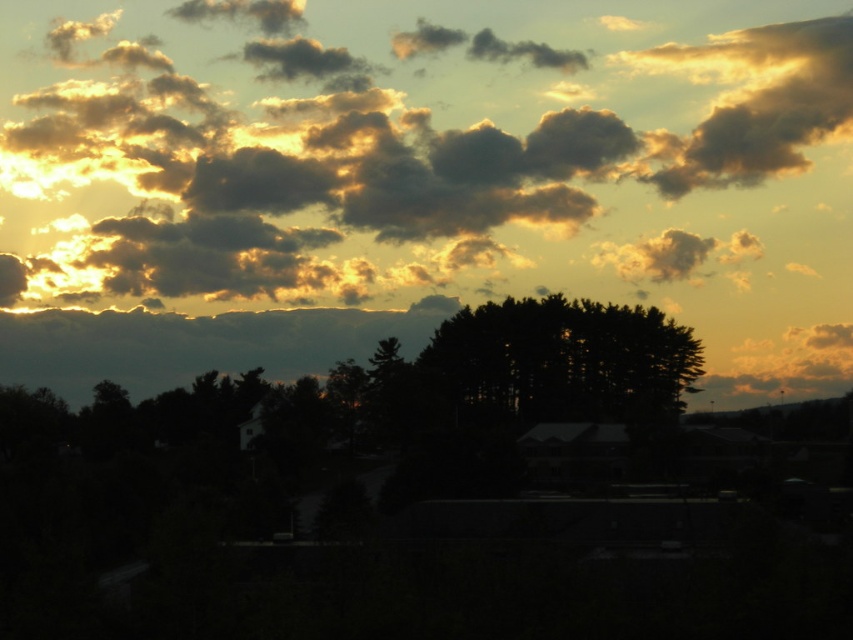
Question: Does golden fluffy cloud at upper center come in front of black matte tree at center?

Choices:
 (A) yes
 (B) no

Answer: (B)

Question: Is golden fluffy cloud at upper center to the left of black matte tree at center from the viewer's perspective?

Choices:
 (A) yes
 (B) no

Answer: (A)

Question: Can you confirm if golden fluffy cloud at upper center is bigger than black matte tree at center?

Choices:
 (A) no
 (B) yes

Answer: (B)